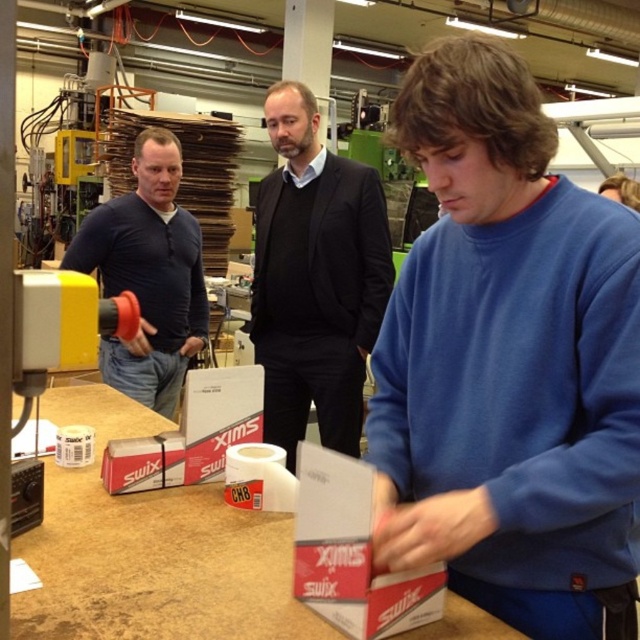
What do you see at coordinates (509, 362) in the screenshot? The height and width of the screenshot is (640, 640). I see `blue cotton sweatshirt at center` at bounding box center [509, 362].

Does blue cotton sweatshirt at center have a lesser height compared to black matte suit at center?

Indeed, blue cotton sweatshirt at center has a lesser height compared to black matte suit at center.

Describe the element at coordinates (509, 362) in the screenshot. I see `blue cotton sweatshirt at center` at that location.

At what (x,y) coordinates should I click in order to perform the action: click on blue cotton sweatshirt at center. Please return your answer as a coordinate pair (x, y). The image size is (640, 640). Looking at the image, I should click on point(509,362).

Is blue cotton sweatshirt at center to the left of matte black shirt at left from the viewer's perspective?

Incorrect, blue cotton sweatshirt at center is not on the left side of matte black shirt at left.

Who is more distant from viewer, (563,348) or (134,269)?

The point (134,269) is more distant.

This screenshot has width=640, height=640. What are the coordinates of `blue cotton sweatshirt at center` in the screenshot? It's located at click(509, 362).

Does black matte suit at center have a greater height compared to matte black shirt at left?

Yes, black matte suit at center is taller than matte black shirt at left.

Does point (323, 426) come behind point (125, 380)?

No, it is in front of (125, 380).

Measure the distance between point (280,124) and camera.

Point (280,124) and camera are 7.66 feet apart from each other.

Find the location of a particular element. Image resolution: width=640 pixels, height=640 pixels. black matte suit at center is located at coordinates (316, 278).